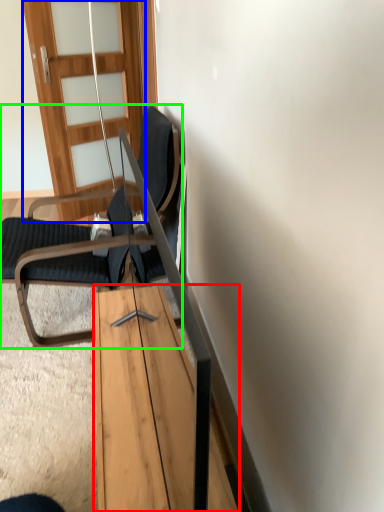
Question: Which object is the farthest from table (highlighted by a red box)? Choose among these: door (highlighted by a blue box) or chair (highlighted by a green box).

Choices:
 (A) door
 (B) chair

Answer: (A)